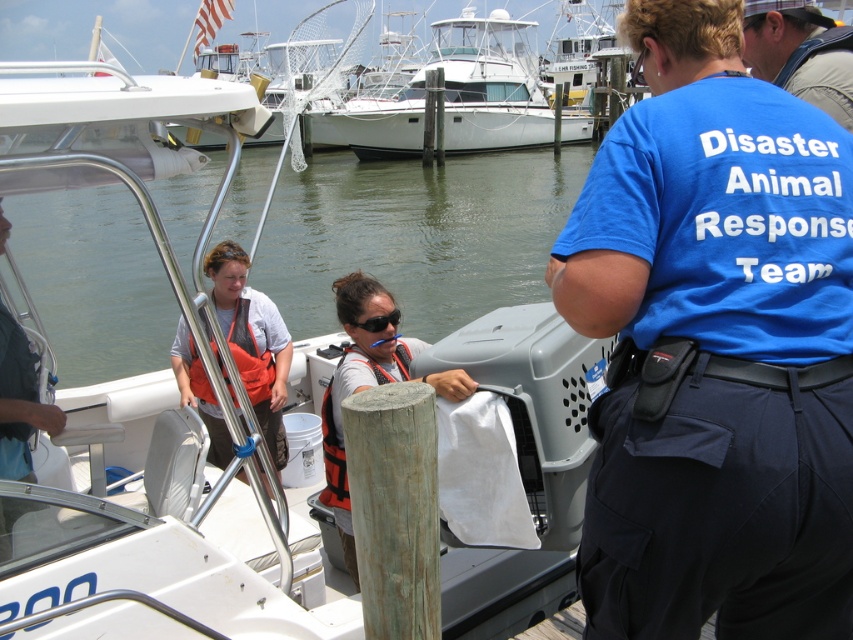
You are a member of the Disaster Animal Response Team and need to quickly grab an item from the boat. The green wood pole at center and orange life jacket at center are both in your line of sight. Which item can you reach first if you prioritize the one taking up more space?

The orange life jacket at center occupies more space than the green wood pole at center, so you can reach the orange life jacket at center first.

You are a member of the Disaster Animal Response Team and need to secure the orange life jacket at left to the white glossy boat at upper center. Given that the boat is wider than the life jacket, will the life jacket fit on the boat?

The white glossy boat at upper center is wider than the orange life jacket at left, so yes, the life jacket will fit on the boat since the boat is wider than the life jacket.